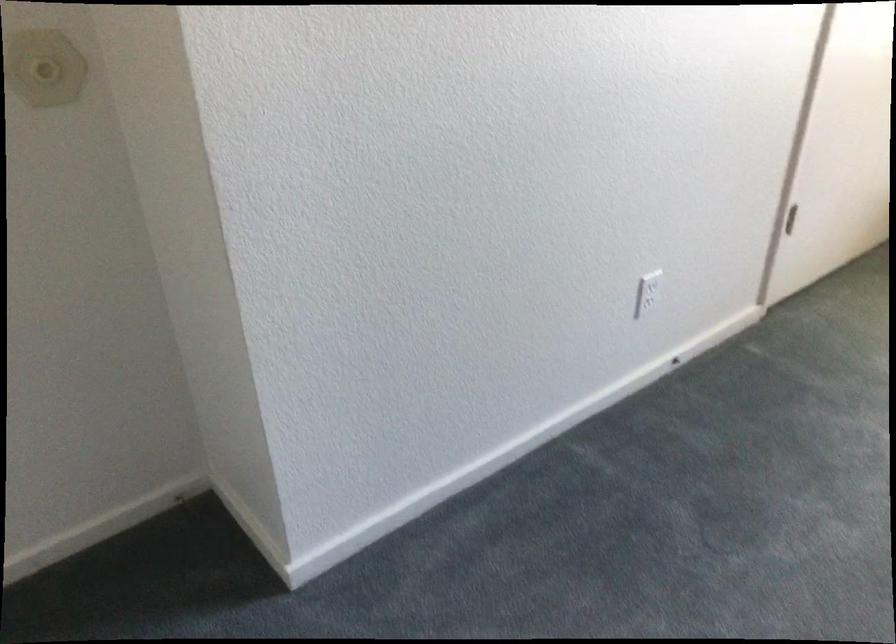
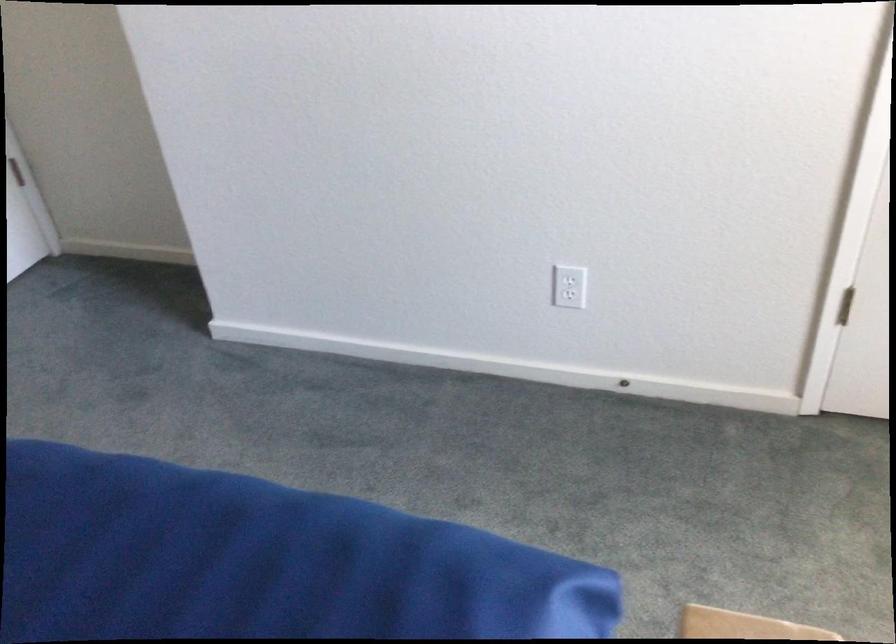
In the second image, find the point that corresponds to point (642, 287) in the first image.

(570, 279)